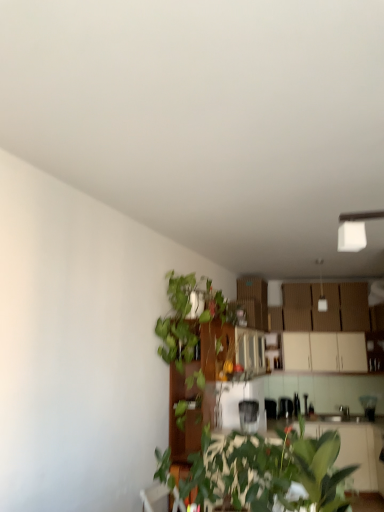
Question: Is metallic silver toaster at center, which ranks as the third appliance in front-to-back order, with metallic silver kettle at center, the second appliance when ordered from front to back?

Choices:
 (A) yes
 (B) no

Answer: (B)

Question: Can you confirm if metallic silver toaster at center, which is counted as the first appliance, starting from the back, is smaller than metallic silver kettle at center, placed as the 2th appliance when sorted from top to bottom?

Choices:
 (A) yes
 (B) no

Answer: (A)

Question: Does metallic silver toaster at center, the 2th appliance in the right-to-left sequence, appear on the right side of metallic silver kettle at center, the second appliance when ordered from front to back?

Choices:
 (A) yes
 (B) no

Answer: (B)

Question: Does metallic silver toaster at center, which is the second appliance from left to right, have a larger size compared to metallic silver kettle at center, the second appliance when ordered from front to back?

Choices:
 (A) no
 (B) yes

Answer: (A)

Question: Is metallic silver toaster at center, which ranks as the 1th appliance in bottom-to-top order, further to the viewer compared to metallic silver kettle at center, placed as the 2th appliance when sorted from top to bottom?

Choices:
 (A) yes
 (B) no

Answer: (A)

Question: Is satin silver toaster at center, acting as the 1th appliance starting from the left, spatially inside green leafy plant at lower center, or outside of it?

Choices:
 (A) inside
 (B) outside

Answer: (B)

Question: Based on their positions, is satin silver toaster at center, marked as the third appliance in a back-to-front arrangement, located to the left or right of green leafy plant at lower center?

Choices:
 (A) right
 (B) left

Answer: (A)

Question: From a real-world perspective, is satin silver toaster at center, the 1th appliance positioned from the front, physically located above or below green leafy plant at lower center?

Choices:
 (A) above
 (B) below

Answer: (B)

Question: Is point (241, 423) positioned closer to the camera than point (205, 455)?

Choices:
 (A) farther
 (B) closer

Answer: (A)

Question: In terms of width, does green matte plant at center look wider or thinner when compared to metallic silver toaster at center, the 3th appliance from the top?

Choices:
 (A) thin
 (B) wide

Answer: (A)

Question: Is point (238, 367) closer or farther from the camera than point (291, 403)?

Choices:
 (A) closer
 (B) farther

Answer: (A)

Question: From a real-world perspective, relative to metallic silver toaster at center, which ranks as the 1th appliance in bottom-to-top order, is green matte plant at center vertically above or below?

Choices:
 (A) below
 (B) above

Answer: (B)

Question: Is green matte plant at center in front of or behind metallic silver toaster at center, which ranks as the third appliance in front-to-back order, in the image?

Choices:
 (A) front
 (B) behind

Answer: (A)

Question: From a real-world perspective, is white matte cabinet at upper right positioned above or below satin silver toaster at center, which ranks as the 1th appliance in top-to-bottom order?

Choices:
 (A) below
 (B) above

Answer: (B)

Question: Choose the correct answer: Is white matte cabinet at upper right inside satin silver toaster at center, acting as the 1th appliance starting from the left, or outside it?

Choices:
 (A) outside
 (B) inside

Answer: (A)